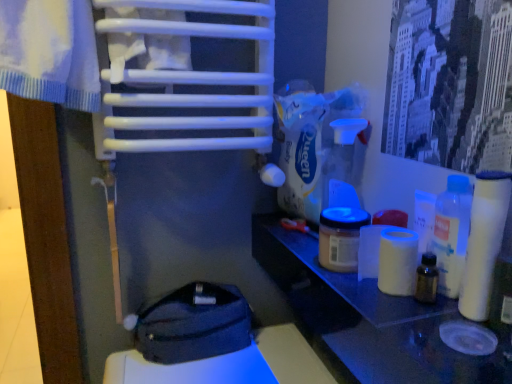
Find the location of a particular element. The image size is (512, 384). free space to the left of white matte toilet paper at right, the first toilet paper viewed from the back is located at coordinates (340, 290).